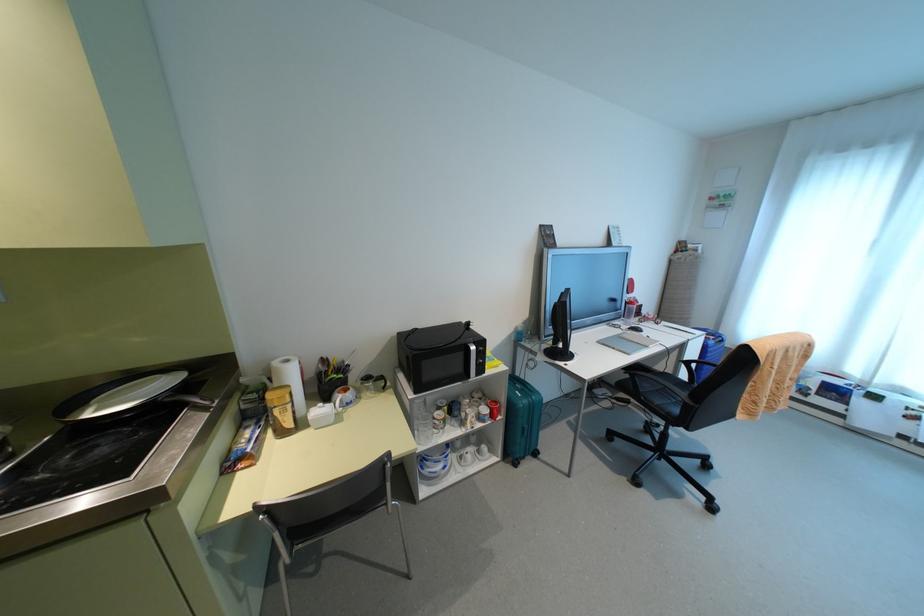
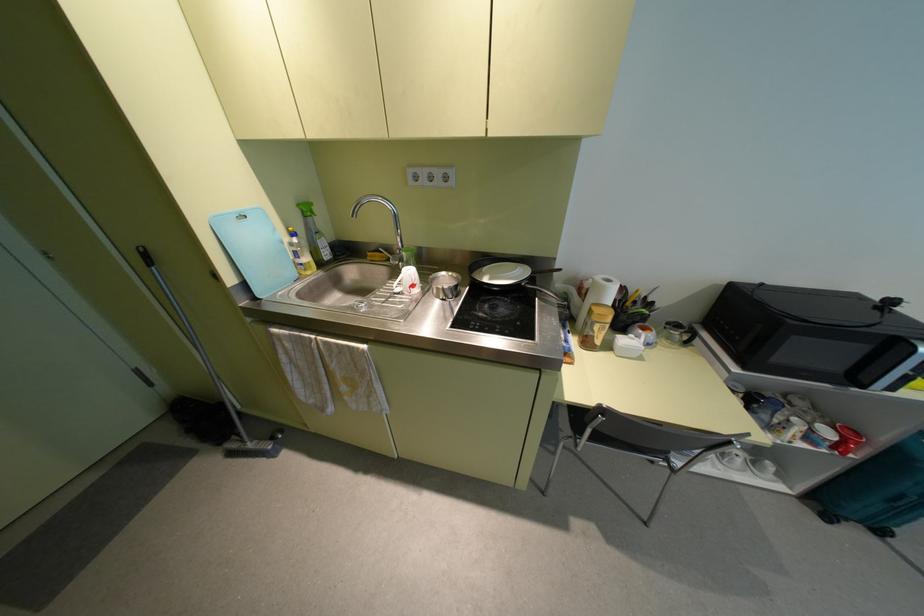
Where in the second image is the point corresponding to (495,402) from the first image?

(857, 434)